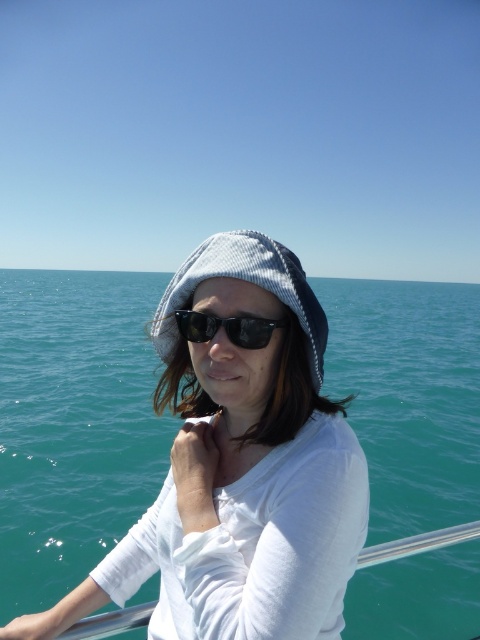
You are a photographer trying to capture the teal water at center in your shot. You notice a point marked at coordinates (73, 424). Where is this point located in relation to the teal water at center?

The point at coordinates (73, 424) corresponds to the teal water at center, so it is located right at the center of the water area.

You are a photographer planning to capture a wide landscape shot of the teal water at center and the woven fabric beanie at center. Given that your camera can focus on objects within 200 feet, will both subjects be in focus?

The distance between the teal water at center and the woven fabric beanie at center is 219.65 feet. Since your camera can only focus within 200 feet, the farther object will be out of focus. The woven fabric beanie at center is closer to you than the teal water at center, so the teal water at center will be out of focus.